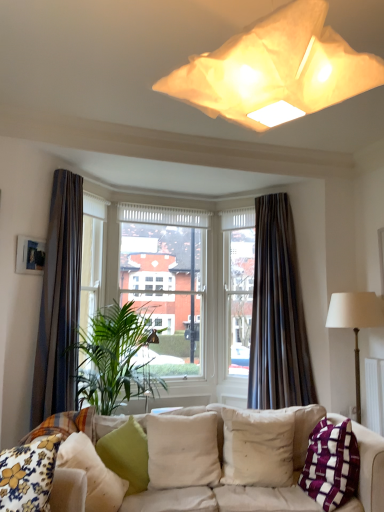
Question: Considering the relative positions of purple woven pillow at lower right, which appears as the first pillow when viewed from the right, and beige fabric pillow at center, which is counted as the 4th pillow, starting from the left, in the image provided, is purple woven pillow at lower right, which appears as the first pillow when viewed from the right, to the left of beige fabric pillow at center, which is counted as the 4th pillow, starting from the left, from the viewer's perspective?

Choices:
 (A) no
 (B) yes

Answer: (A)

Question: Can you confirm if purple woven pillow at lower right, which appears as the first pillow when viewed from the right, is bigger than beige fabric pillow at center, which appears as the third pillow when viewed from the right?

Choices:
 (A) yes
 (B) no

Answer: (A)

Question: Is purple woven pillow at lower right, the 6th pillow from the left, closer to camera compared to beige fabric pillow at center, which is counted as the 4th pillow, starting from the left?

Choices:
 (A) no
 (B) yes

Answer: (B)

Question: From the image's perspective, does purple woven pillow at lower right, which appears as the first pillow when viewed from the right, appear lower than beige fabric pillow at center, which is counted as the 4th pillow, starting from the left?

Choices:
 (A) no
 (B) yes

Answer: (A)

Question: Is purple woven pillow at lower right, the 6th pillow from the left, further to camera compared to beige fabric pillow at center, which is counted as the 4th pillow, starting from the left?

Choices:
 (A) yes
 (B) no

Answer: (B)

Question: Considering the positions of green fabric cushion at lower left, the 4th pillow in the right-to-left sequence, and purple woven pillow at lower right, the 6th pillow from the left, in the image, is green fabric cushion at lower left, the 4th pillow in the right-to-left sequence, taller or shorter than purple woven pillow at lower right, the 6th pillow from the left,?

Choices:
 (A) tall
 (B) short

Answer: (B)

Question: From a real-world perspective, is green fabric cushion at lower left, the 4th pillow in the right-to-left sequence, physically located above or below purple woven pillow at lower right, which appears as the first pillow when viewed from the right?

Choices:
 (A) below
 (B) above

Answer: (A)

Question: Is green fabric cushion at lower left, which is counted as the 3th pillow, starting from the left, situated inside purple woven pillow at lower right, which appears as the first pillow when viewed from the right, or outside?

Choices:
 (A) inside
 (B) outside

Answer: (B)

Question: From the image's perspective, is green fabric cushion at lower left, which is counted as the 3th pillow, starting from the left, above or below purple woven pillow at lower right, which appears as the first pillow when viewed from the right?

Choices:
 (A) above
 (B) below

Answer: (B)

Question: From their relative heights in the image, would you say brown fabric curtain at left, which ranks as the second curtain in right-to-left order, is taller or shorter than green fabric pillow at lower left, arranged as the 2th pillow when viewed from the left?

Choices:
 (A) short
 (B) tall

Answer: (B)

Question: From the image's perspective, is brown fabric curtain at left, which ranks as the second curtain in right-to-left order, positioned above or below green fabric pillow at lower left, arranged as the 2th pillow when viewed from the left?

Choices:
 (A) below
 (B) above

Answer: (B)

Question: Considering the positions of brown fabric curtain at left, which ranks as the second curtain in right-to-left order, and green fabric pillow at lower left, which is counted as the 5th pillow, starting from the right, in the image, is brown fabric curtain at left, which ranks as the second curtain in right-to-left order, wider or thinner than green fabric pillow at lower left, which is counted as the 5th pillow, starting from the right,?

Choices:
 (A) wide
 (B) thin

Answer: (B)

Question: Does point (77, 244) appear closer or farther from the camera than point (64, 464)?

Choices:
 (A) closer
 (B) farther

Answer: (B)

Question: In terms of size, does purple woven pillow at lower right, which appears as the first pillow when viewed from the right, appear bigger or smaller than dark velvet curtain at center, which ranks as the first curtain in right-to-left order?

Choices:
 (A) big
 (B) small

Answer: (B)

Question: In terms of height, does purple woven pillow at lower right, which appears as the first pillow when viewed from the right, look taller or shorter compared to dark velvet curtain at center, which ranks as the first curtain in right-to-left order?

Choices:
 (A) tall
 (B) short

Answer: (B)